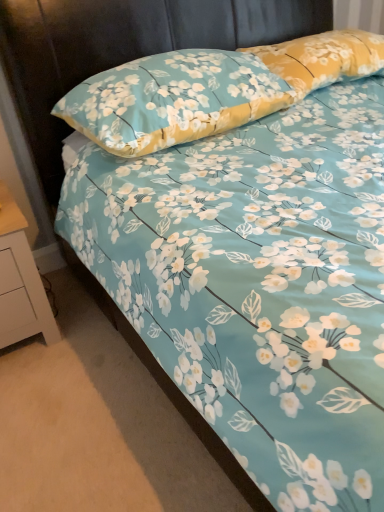
Question: Considering the relative sizes of white painted wood nightstand at lower left and floral fabric pillow at upper center, the second pillow positioned from the right, in the image provided, is white painted wood nightstand at lower left taller than floral fabric pillow at upper center, the second pillow positioned from the right,?

Choices:
 (A) no
 (B) yes

Answer: (B)

Question: From a real-world perspective, is white painted wood nightstand at lower left located beneath floral fabric pillow at upper center, the second pillow positioned from the right?

Choices:
 (A) yes
 (B) no

Answer: (A)

Question: Could you tell me if white painted wood nightstand at lower left is facing floral fabric pillow at upper center, the first pillow from the left?

Choices:
 (A) no
 (B) yes

Answer: (A)

Question: Would you say white painted wood nightstand at lower left is outside floral fabric pillow at upper center, the second pillow positioned from the right?

Choices:
 (A) no
 (B) yes

Answer: (B)

Question: Can you confirm if white painted wood nightstand at lower left is positioned to the right of floral fabric pillow at upper center, the first pillow from the left?

Choices:
 (A) yes
 (B) no

Answer: (B)

Question: Is white painted wood nightstand at lower left shorter than floral fabric pillow at upper center, the second pillow positioned from the right?

Choices:
 (A) no
 (B) yes

Answer: (A)

Question: Considering the relative positions of yellow floral pillow at upper right, which is the 1th pillow in right-to-left order, and floral fabric pillow at upper center, the second pillow positioned from the right, in the image provided, is yellow floral pillow at upper right, which is the 1th pillow in right-to-left order, to the right of floral fabric pillow at upper center, the second pillow positioned from the right, from the viewer's perspective?

Choices:
 (A) yes
 (B) no

Answer: (A)

Question: Is yellow floral pillow at upper right, which is the 1th pillow in right-to-left order, thinner than floral fabric pillow at upper center, the second pillow positioned from the right?

Choices:
 (A) no
 (B) yes

Answer: (B)

Question: Is yellow floral pillow at upper right, which is counted as the 2th pillow, starting from the left, looking in the opposite direction of floral fabric pillow at upper center, the first pillow from the left?

Choices:
 (A) no
 (B) yes

Answer: (A)

Question: Does yellow floral pillow at upper right, which is counted as the 2th pillow, starting from the left, have a greater height compared to floral fabric pillow at upper center, the second pillow positioned from the right?

Choices:
 (A) no
 (B) yes

Answer: (A)

Question: Is yellow floral pillow at upper right, which is counted as the 2th pillow, starting from the left, outside of floral fabric pillow at upper center, the first pillow from the left?

Choices:
 (A) no
 (B) yes

Answer: (B)

Question: From the image's perspective, is yellow floral pillow at upper right, which is the 1th pillow in right-to-left order, beneath floral fabric pillow at upper center, the second pillow positioned from the right?

Choices:
 (A) yes
 (B) no

Answer: (B)

Question: Considering the relative positions of yellow floral pillow at upper right, which is the 1th pillow in right-to-left order, and white painted wood nightstand at lower left in the image provided, is yellow floral pillow at upper right, which is the 1th pillow in right-to-left order, to the left of white painted wood nightstand at lower left from the viewer's perspective?

Choices:
 (A) no
 (B) yes

Answer: (A)